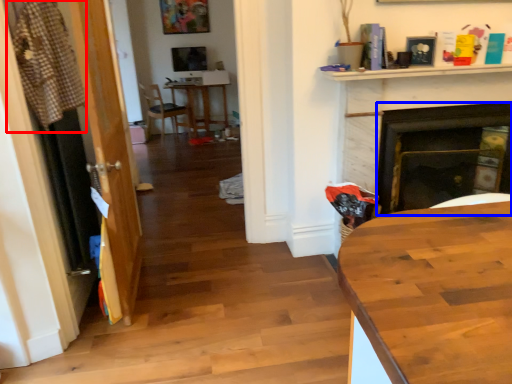
Question: Which of the following is the farthest to the observer, laundry (highlighted by a red box) or fireplace (highlighted by a blue box)?

Choices:
 (A) laundry
 (B) fireplace

Answer: (B)